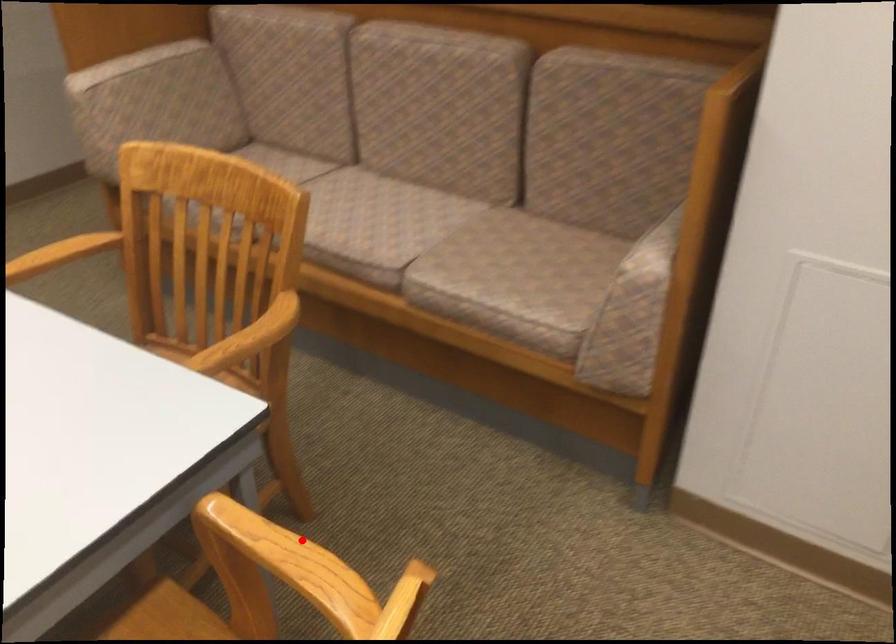
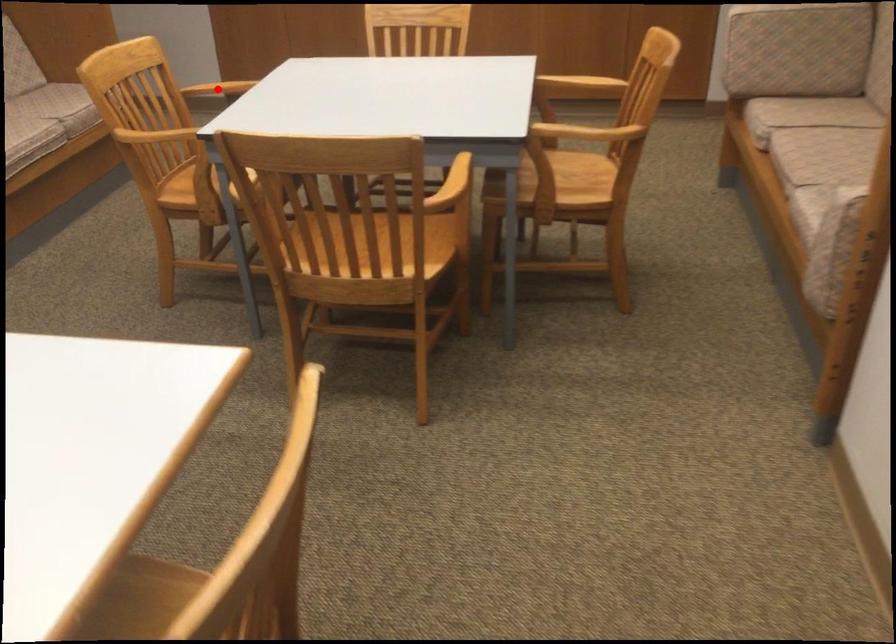
I am providing you with two images of the same scene from different viewpoints. A red point is marked on the first image and another point is marked on the second image. Is the red point in image1 aligned with the point shown in image2?

No